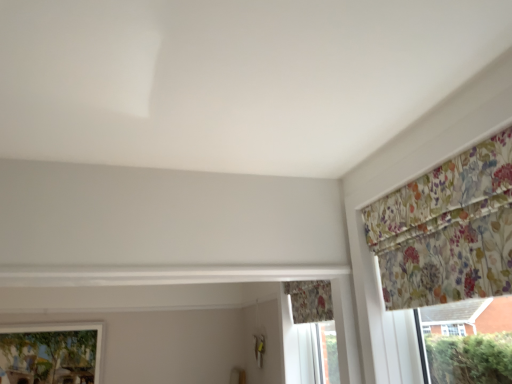
Question: Is floral fabric curtain at upper right, marked as the first curtain in a front-to-back arrangement, smaller than floral fabric curtain at lower center, which is the second curtain in top-to-bottom order?

Choices:
 (A) yes
 (B) no

Answer: (B)

Question: Is floral fabric curtain at upper right, positioned as the 1th curtain in top-to-bottom order, further to the viewer compared to floral fabric curtain at lower center, which ranks as the first curtain in bottom-to-top order?

Choices:
 (A) no
 (B) yes

Answer: (A)

Question: Can you confirm if floral fabric curtain at upper right, which ranks as the 2th curtain in back-to-front order, is bigger than floral fabric curtain at lower center, which ranks as the 1th curtain in back-to-front order?

Choices:
 (A) yes
 (B) no

Answer: (A)

Question: Does floral fabric curtain at upper right, positioned as the 1th curtain in top-to-bottom order, have a greater height compared to floral fabric curtain at lower center, positioned as the 2th curtain in front-to-back order?

Choices:
 (A) no
 (B) yes

Answer: (B)

Question: Is floral fabric curtain at lower center, placed as the first curtain when sorted from left to right, completely or partially inside floral fabric curtain at upper right, which ranks as the 2th curtain in back-to-front order?

Choices:
 (A) yes
 (B) no

Answer: (B)

Question: From a real-world perspective, is floral fabric curtain at upper right, which ranks as the 2th curtain in back-to-front order, positioned under floral fabric curtain at lower center, positioned as the 2th curtain in front-to-back order, based on gravity?

Choices:
 (A) yes
 (B) no

Answer: (B)

Question: Is floral fabric curtain at lower center, which is the second curtain in top-to-bottom order, positioned with its back to matte glass window at lower left?

Choices:
 (A) yes
 (B) no

Answer: (B)

Question: From a real-world perspective, is floral fabric curtain at lower center, marked as the 2th curtain in a right-to-left arrangement, below matte glass window at lower left?

Choices:
 (A) yes
 (B) no

Answer: (B)

Question: Would you say floral fabric curtain at lower center, which ranks as the first curtain in bottom-to-top order, contains matte glass window at lower left?

Choices:
 (A) no
 (B) yes

Answer: (A)

Question: Could you tell me if floral fabric curtain at lower center, marked as the 2th curtain in a right-to-left arrangement, is turned towards matte glass window at lower left?

Choices:
 (A) no
 (B) yes

Answer: (A)

Question: Is floral fabric curtain at lower center, which ranks as the first curtain in bottom-to-top order, at the left side of matte glass window at lower left?

Choices:
 (A) yes
 (B) no

Answer: (B)

Question: Considering the relative sizes of floral fabric curtain at lower center, positioned as the 2th curtain in front-to-back order, and matte glass window at lower left in the image provided, is floral fabric curtain at lower center, positioned as the 2th curtain in front-to-back order, bigger than matte glass window at lower left?

Choices:
 (A) no
 (B) yes

Answer: (A)

Question: Is floral fabric curtain at lower center, marked as the 2th curtain in a right-to-left arrangement, outside floral fabric curtain at upper right, marked as the first curtain in a front-to-back arrangement?

Choices:
 (A) yes
 (B) no

Answer: (A)